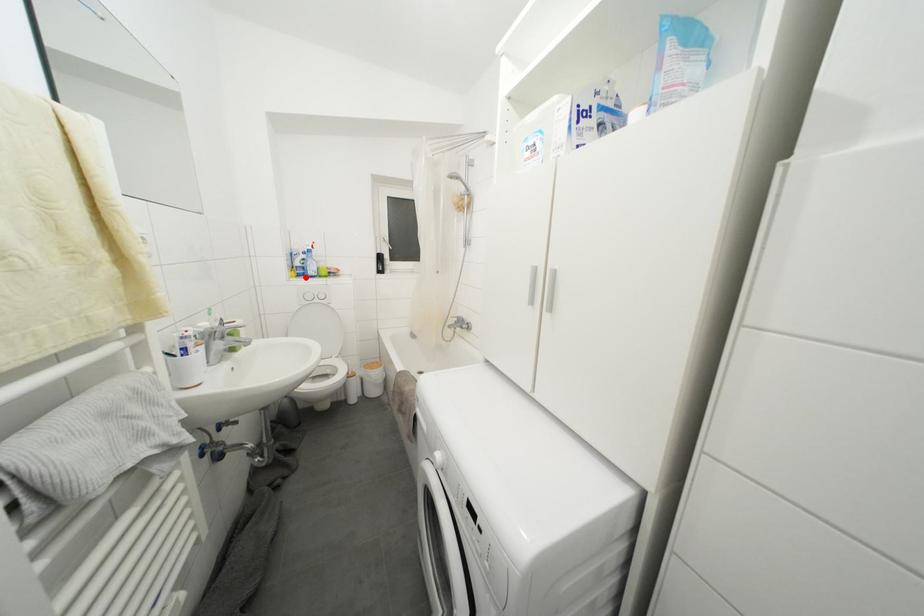
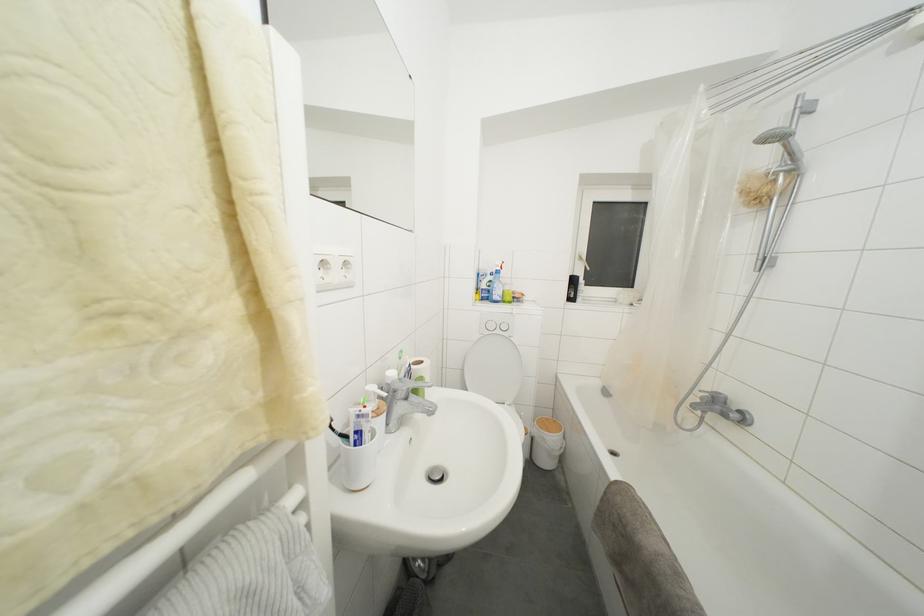
In the second image, find the point that corresponds to the highlighted location in the first image.

(490, 301)